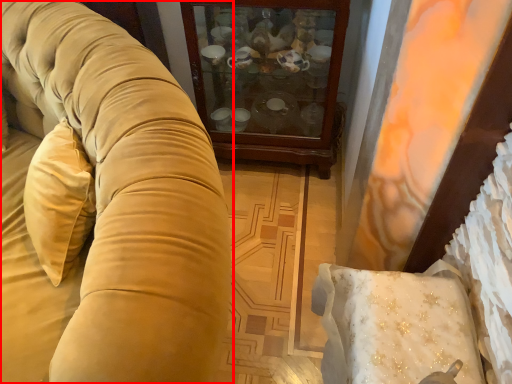
Question: From the image's perspective, what is the correct spatial relationship of studio couch (annotated by the red box) in relation to furniture?

Choices:
 (A) above
 (B) below

Answer: (B)